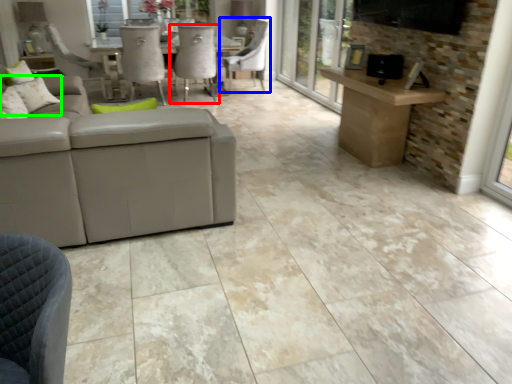
Question: Which is nearer to the chair (highlighted by a red box)? chair (highlighted by a blue box) or pillow (highlighted by a green box).

Choices:
 (A) chair
 (B) pillow

Answer: (A)